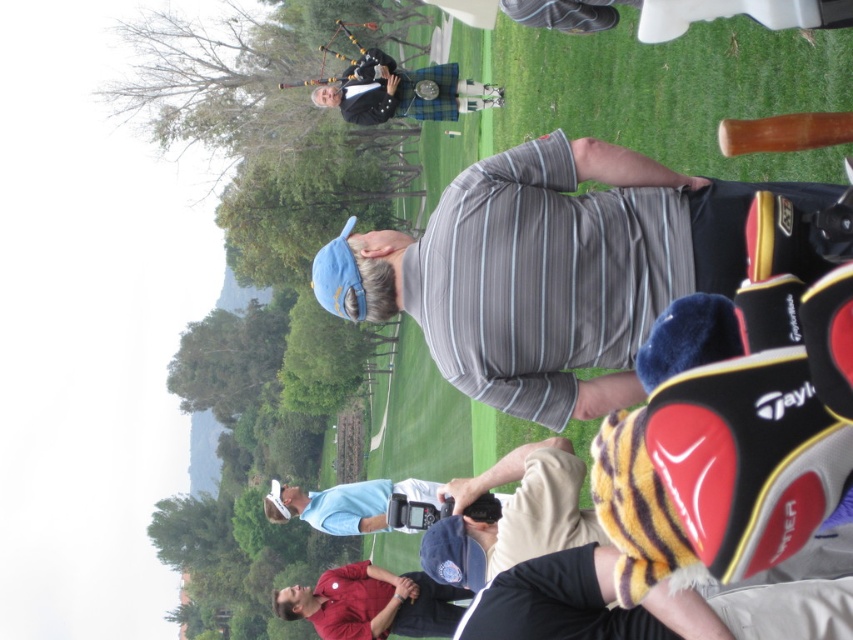
Measure the distance between gray striped shirt at center and camera.

They are 10.41 meters apart.

Is gray striped shirt at center smaller than matte red shirt at lower center?

Actually, gray striped shirt at center might be larger than matte red shirt at lower center.

Does point (537, 371) lie in front of point (364, 593)?

That is True.

This screenshot has height=640, width=853. In order to click on gray striped shirt at center in this screenshot , I will do [x=550, y=269].

Is matte red shirt at lower center shorter than plaid fabric kilt at upper center?

Indeed, matte red shirt at lower center has a lesser height compared to plaid fabric kilt at upper center.

Between point (389, 593) and point (477, 88), which one is positioned in front?

Point (389, 593) is more forward.

The width and height of the screenshot is (853, 640). I want to click on matte red shirt at lower center, so click(x=372, y=604).

Measure the distance between gray striped shirt at center and camera.

gray striped shirt at center is 10.41 meters from camera.

Between gray striped shirt at center and plaid fabric kilt at upper center, which one appears on the right side from the viewer's perspective?

From the viewer's perspective, gray striped shirt at center appears more on the right side.

Between point (479, 384) and point (358, 100), which one is positioned behind?

The point (358, 100) is behind.

Where is `gray striped shirt at center`? gray striped shirt at center is located at coordinates (550, 269).